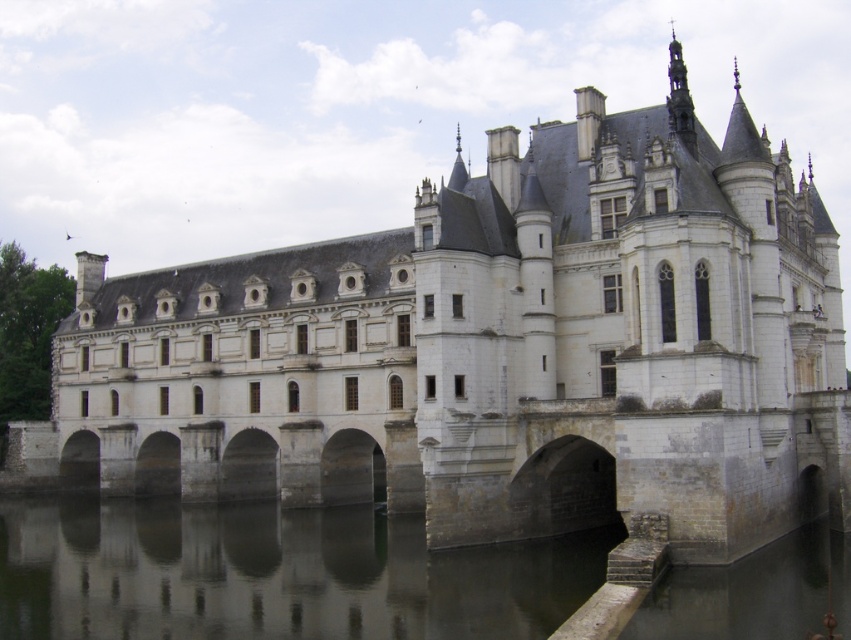
Question: Is smooth gray water at lower center further to camera compared to stone arch bridge at center?

Choices:
 (A) yes
 (B) no

Answer: (B)

Question: Which of the following is the closest to the observer?

Choices:
 (A) (190, 604)
 (B) (215, 467)

Answer: (A)

Question: Among these points, which one is farthest from the camera?

Choices:
 (A) (221, 563)
 (B) (310, 483)

Answer: (B)

Question: Does smooth gray water at lower center appear under stone arch bridge at center?

Choices:
 (A) no
 (B) yes

Answer: (B)

Question: In this image, where is smooth gray water at lower center located relative to stone arch bridge at center?

Choices:
 (A) above
 (B) below

Answer: (B)